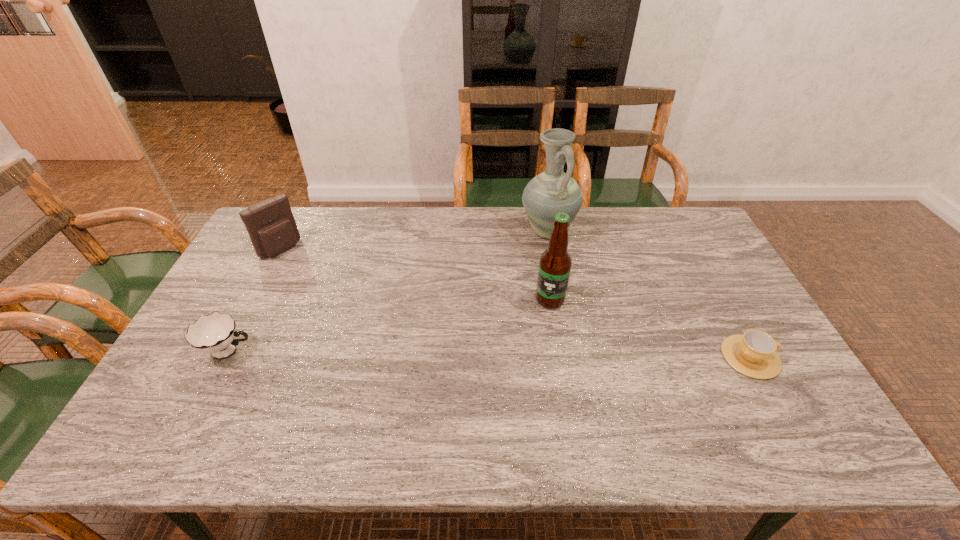
Locate an element on the screen. This screenshot has height=540, width=960. vacant space on the desktop that is between the taller cup and the shorter cup and is positioned with an open flap on the pouch is located at coordinates (414, 353).

Where is `vacant space on the desktop that is between the taller cup and the rightmost object and is positioned on the label of the fourth shortest object`? This screenshot has height=540, width=960. vacant space on the desktop that is between the taller cup and the rightmost object and is positioned on the label of the fourth shortest object is located at coordinates (513, 354).

In order to click on vacant spot on the desktop that is between the taller cup and the shorter cup and is positioned on the handle side of the tallest object in this screenshot , I will do `click(558, 355)`.